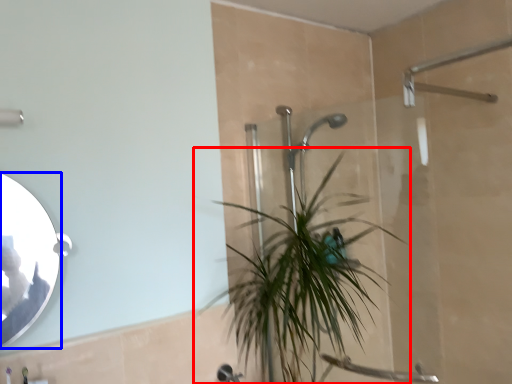
Question: Which point is further to the camera, houseplant (highlighted by a red box) or mirror (highlighted by a blue box)?

Choices:
 (A) houseplant
 (B) mirror

Answer: (A)